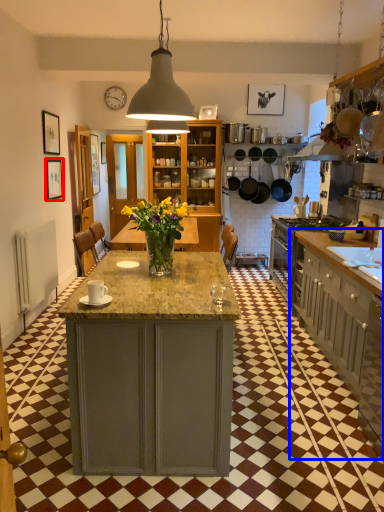
Question: Which object is further to the camera taking this photo, picture frame (highlighted by a red box) or cabinetry (highlighted by a blue box)?

Choices:
 (A) picture frame
 (B) cabinetry

Answer: (A)